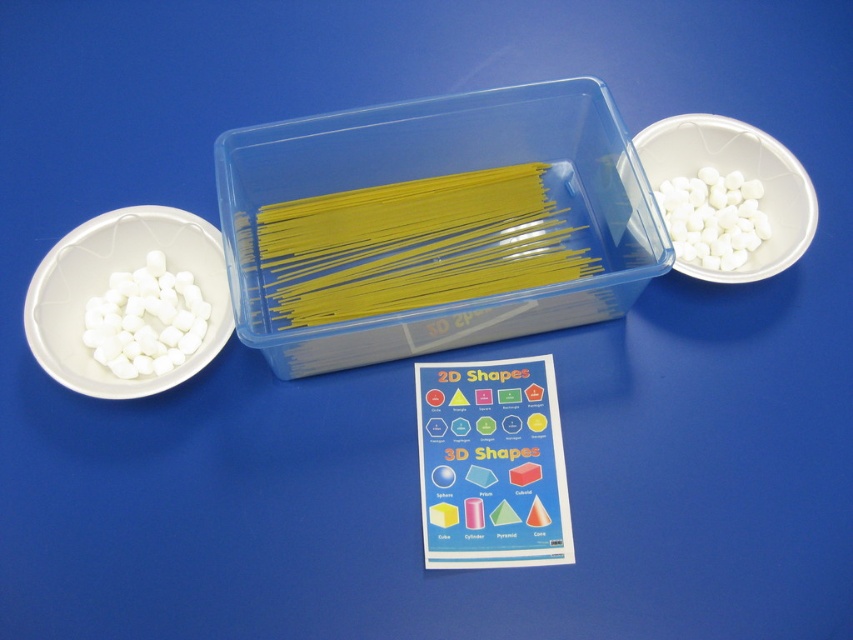
Question: Does white matte bowl at left come in front of white matte bowl at upper right?

Choices:
 (A) no
 (B) yes

Answer: (B)

Question: Which of these objects is positioned farthest from the white matte bowl at left?

Choices:
 (A) transparent plastic container at center
 (B) white matte bowl at upper right

Answer: (B)

Question: Which is nearer to the transparent plastic container at center?

Choices:
 (A) white matte bowl at left
 (B) white matte marshmallows at left
 (C) white matte bowl at upper right

Answer: (A)

Question: Is transparent plastic container at center above white matte marshmallows at right?

Choices:
 (A) yes
 (B) no

Answer: (B)

Question: Which point appears closest to the camera in this image?

Choices:
 (A) (151, 321)
 (B) (723, 195)

Answer: (A)

Question: Can you confirm if transparent plastic container at center is positioned to the right of white matte bowl at upper right?

Choices:
 (A) no
 (B) yes

Answer: (A)